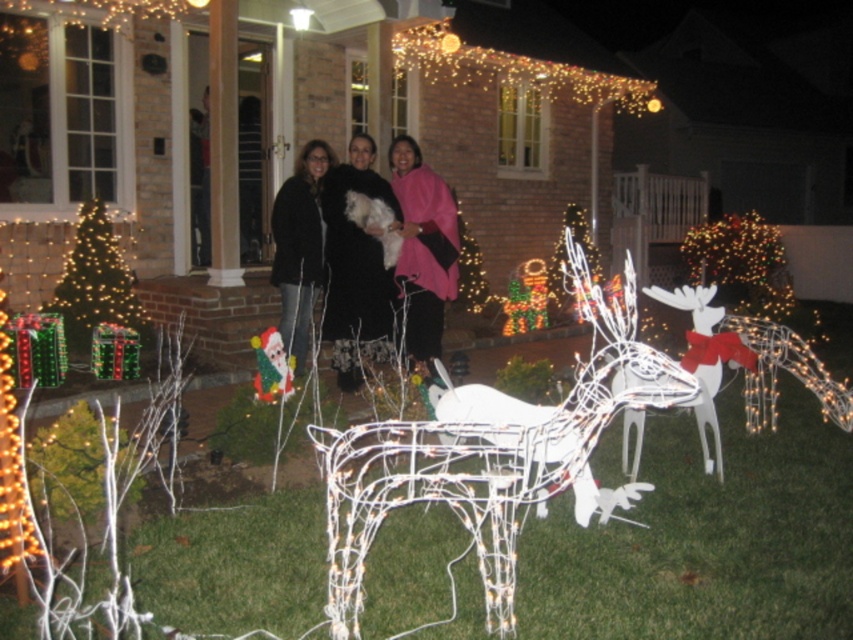
From the picture: You are standing in the festive outdoor scene and need to find the black fuzzy coat at center. Which direction should you look relative to the green wire christmas tree at left?

The black fuzzy coat at center is to the right of the green wire christmas tree at left, so you should look to the right side of the green wire christmas tree at left to find it.

You are standing in front of the house and want to take a photo of the two reindeer figures. Which of the two points, point (358, 332) or point (413, 220), would appear closer to you in the photo?

Point (358, 332) is closer to the camera than point (413, 220), so it would appear closer in the photo.